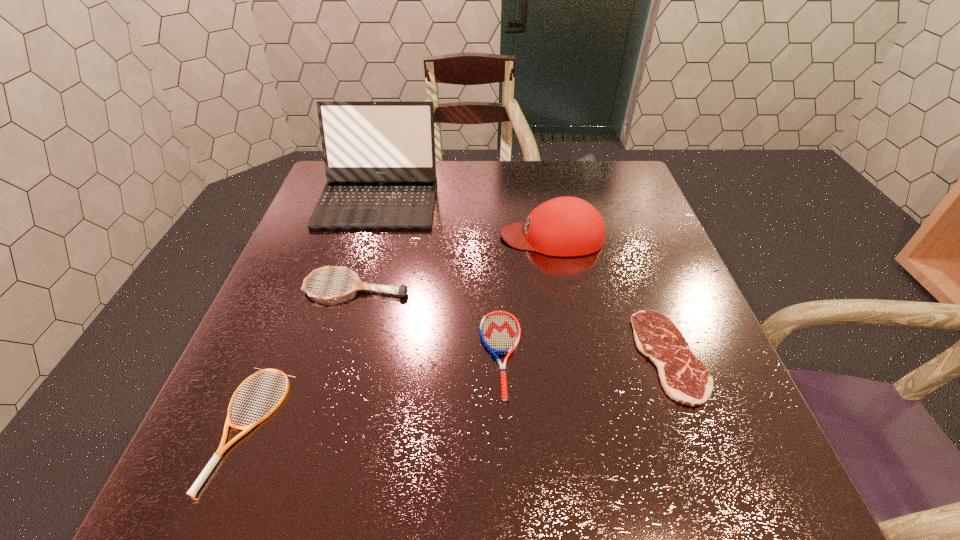
Where is `the second closest object to the rightmost tennis racket`? the second closest object to the rightmost tennis racket is located at coordinates (566, 226).

Locate an element on the screen. The width and height of the screenshot is (960, 540). object identified as the closest to the steak is located at coordinates (566, 226).

Where is `tennis racket that is the closest to the fourth nearest object`? The width and height of the screenshot is (960, 540). tennis racket that is the closest to the fourth nearest object is located at coordinates (500, 331).

Where is `tennis racket that stands as the closest to the farthest tennis racket`? The image size is (960, 540). tennis racket that stands as the closest to the farthest tennis racket is located at coordinates (500, 331).

This screenshot has width=960, height=540. Identify the location of vacant space that satisfies the following two spatial constraints: 1. on the surface of the tallest object; 2. on the right side of the rightmost tennis racket. (333, 354).

Identify the location of free space in the image that satisfies the following two spatial constraints: 1. on the surface of the farthest tennis racket; 2. on the right side of the laptop. This screenshot has height=540, width=960. (353, 287).

At what (x,y) coordinates should I click in order to perform the action: click on vacant position in the image that satisfies the following two spatial constraints: 1. on the surface of the tallest object; 2. on the left side of the farthest tennis racket. Please return your answer as a coordinate pair (x, y). The width and height of the screenshot is (960, 540). Looking at the image, I should click on (353, 287).

Find the location of a particular element. free space that satisfies the following two spatial constraints: 1. on the front-facing side of the baseball cap; 2. on the right side of the steak is located at coordinates (574, 356).